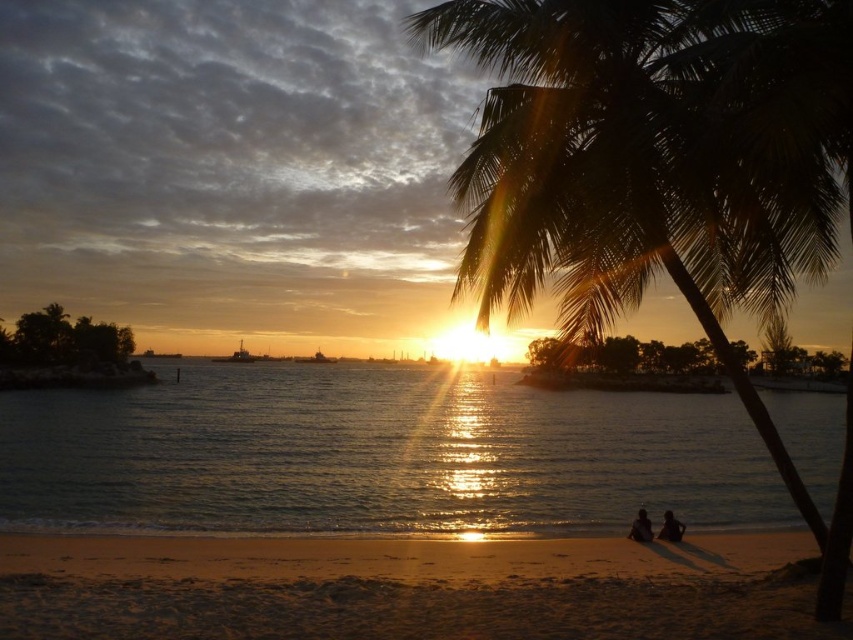
Question: Which point is farther from the camera taking this photo?

Choices:
 (A) (645, 524)
 (B) (619, 38)

Answer: (A)

Question: Among these points, which one is farthest from the camera?

Choices:
 (A) click(x=221, y=474)
 (B) click(x=663, y=540)
 (C) click(x=381, y=579)
 (D) click(x=637, y=531)

Answer: (A)

Question: Is green leafy palm tree at right to the right of sandy beach at lower center from the viewer's perspective?

Choices:
 (A) yes
 (B) no

Answer: (A)

Question: Can you confirm if smooth skin couple at lower center is thinner than silhouette human at lower right?

Choices:
 (A) no
 (B) yes

Answer: (A)

Question: Based on their relative distances, which object is nearer to the silhouette human at lower right?

Choices:
 (A) green leafy palm tree at right
 (B) sandy beach at lower center
 (C) shiny metallic water at center

Answer: (B)

Question: Is shiny metallic water at center to the right of silhouette human at lower right from the viewer's perspective?

Choices:
 (A) no
 (B) yes

Answer: (A)